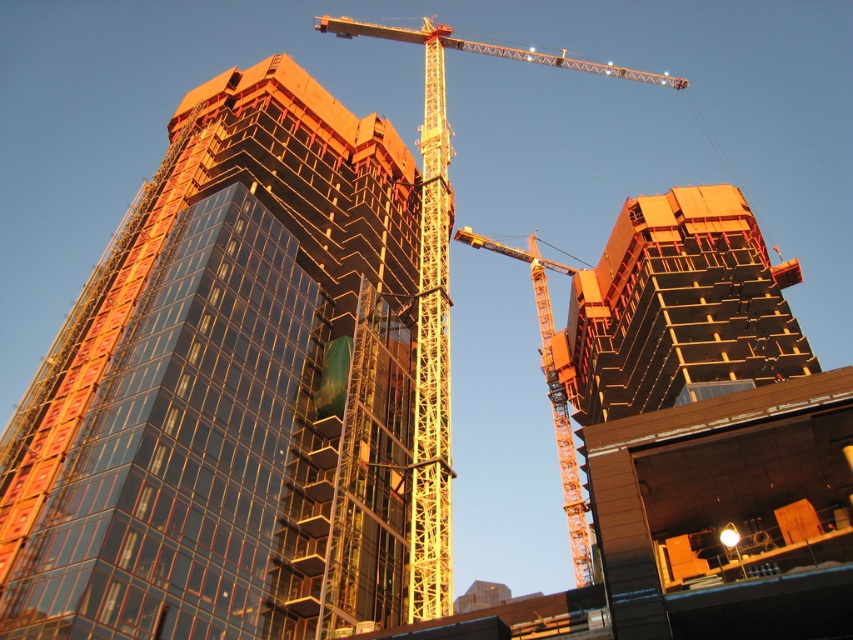
You are an engineer inspecting the construction site. You need to determine which crane has a larger width between the yellow metallic crane at center and the orange metallic crane at center. Can you confirm which one is wider?

The yellow metallic crane at center might be wider than orange metallic crane at center, so the yellow one is possibly wider.

You are a construction worker standing at the origin point of the coordinate system. You need to place a new safety net at the location of the glassy reflective building at center. What are the coordinates where you should place the safety net?

The coordinates for placing the safety net at the glassy reflective building at center are at point (228, 388).